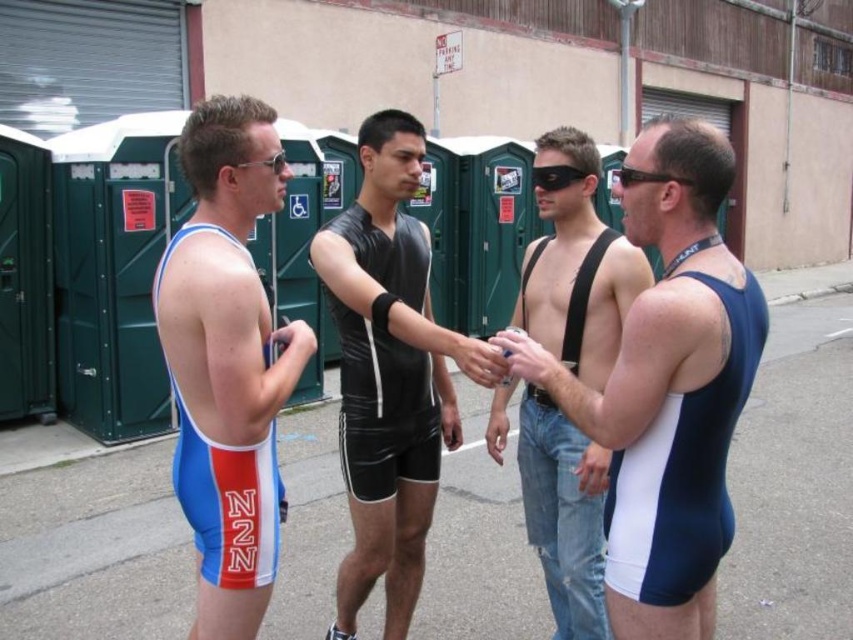
Question: Is blue/white/red fabric singlet at left smaller than matte black hand at center?

Choices:
 (A) yes
 (B) no

Answer: (B)

Question: Which point appears closest to the camera in this image?

Choices:
 (A) (370, 150)
 (B) (579, 476)
 (C) (509, 333)
 (D) (190, 353)

Answer: (D)

Question: Which of these objects is positioned farthest from the matte black hand at center?

Choices:
 (A) blue/white/red fabric singlet at left
 (B) white matte hand at center
 (C) denim jeans at center
 (D) matte blue skin at center

Answer: (A)

Question: Is matte blue skin at center behind white matte hand at center?

Choices:
 (A) no
 (B) yes

Answer: (A)

Question: Which point is closer to the camera taking this photo?

Choices:
 (A) (451, 337)
 (B) (374, 545)
 (C) (514, 342)
 (D) (585, 490)

Answer: (C)

Question: Does blue/white/red fabric singlet at left come in front of denim jeans at center?

Choices:
 (A) yes
 (B) no

Answer: (A)